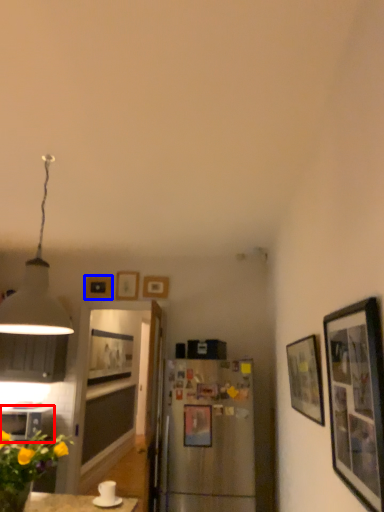
Question: Which object appears farthest to the camera in this image, cabinetry (highlighted by a red box) or picture frame (highlighted by a blue box)?

Choices:
 (A) cabinetry
 (B) picture frame

Answer: (B)